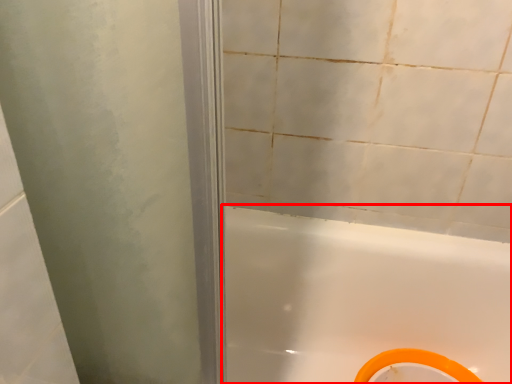
Question: From the image's perspective, considering the relative positions of bathtub (annotated by the red box) and bidet in the image provided, where is bathtub (annotated by the red box) located with respect to the staircase?

Choices:
 (A) above
 (B) below

Answer: (A)